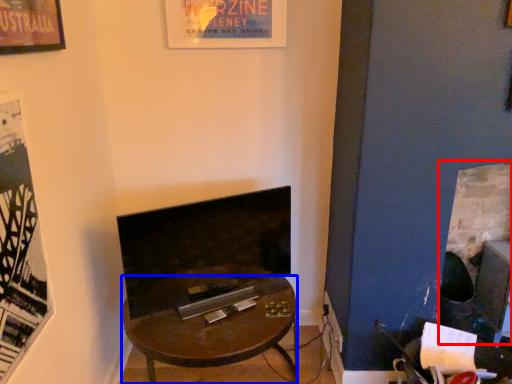
Question: Which object appears farthest to the camera in this image, fireplace (highlighted by a red box) or desk (highlighted by a blue box)?

Choices:
 (A) fireplace
 (B) desk

Answer: (A)